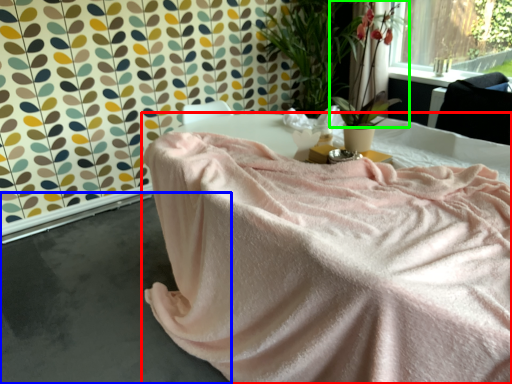
Question: Estimate the real-world distances between objects in this image. Which object is closer to furniture (highlighted by a red box), concrete (highlighted by a blue box) or floral arrangement (highlighted by a green box)?

Choices:
 (A) concrete
 (B) floral arrangement

Answer: (A)